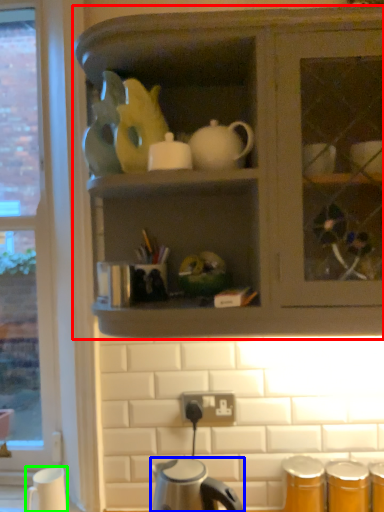
Question: Based on their relative distances, which object is farther from cabinetry (highlighted by a red box)? Choose from kettle (highlighted by a blue box) and coffee cup (highlighted by a green box).

Choices:
 (A) kettle
 (B) coffee cup

Answer: (B)